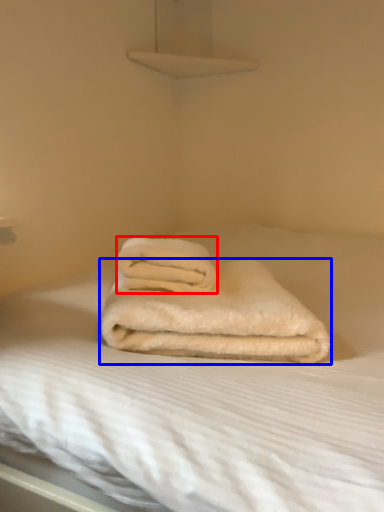
Question: Among these objects, which one is farthest to the camera, towel (highlighted by a red box) or towel (highlighted by a blue box)?

Choices:
 (A) towel
 (B) towel

Answer: (A)